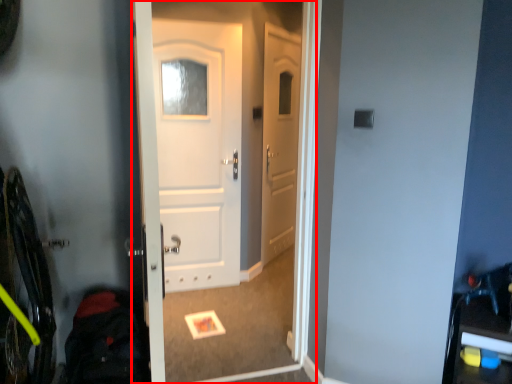
Question: Observing the image, what is the correct spatial positioning of screen door (annotated by the red box) in reference to back?

Choices:
 (A) right
 (B) left

Answer: (A)